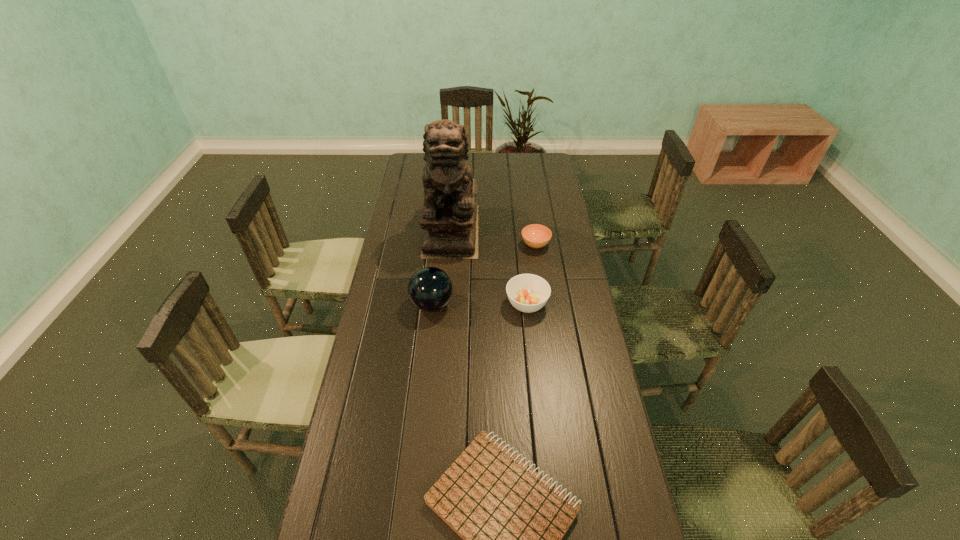
Locate an element on the screen. free spot between the bowling ball and the nearer soup bowl is located at coordinates (479, 304).

Identify the location of object that is the closest to the sculpture. (430, 289).

Where is `object that is the second closest to the nearer soup bowl`? Image resolution: width=960 pixels, height=540 pixels. object that is the second closest to the nearer soup bowl is located at coordinates (449, 218).

Locate an element on the screen. free space that satisfies the following two spatial constraints: 1. on the front side of the farther soup bowl; 2. on the side of the bowling ball with the finger holes is located at coordinates (544, 305).

Where is `free space that satisfies the following two spatial constraints: 1. on the front-facing side of the sculpture; 2. on the right side of the taller soup bowl`? The height and width of the screenshot is (540, 960). free space that satisfies the following two spatial constraints: 1. on the front-facing side of the sculpture; 2. on the right side of the taller soup bowl is located at coordinates (445, 304).

Image resolution: width=960 pixels, height=540 pixels. What are the coordinates of `vacant position in the image that satisfies the following two spatial constraints: 1. on the front-facing side of the tallest object; 2. on the left side of the third tallest object` in the screenshot? It's located at (445, 304).